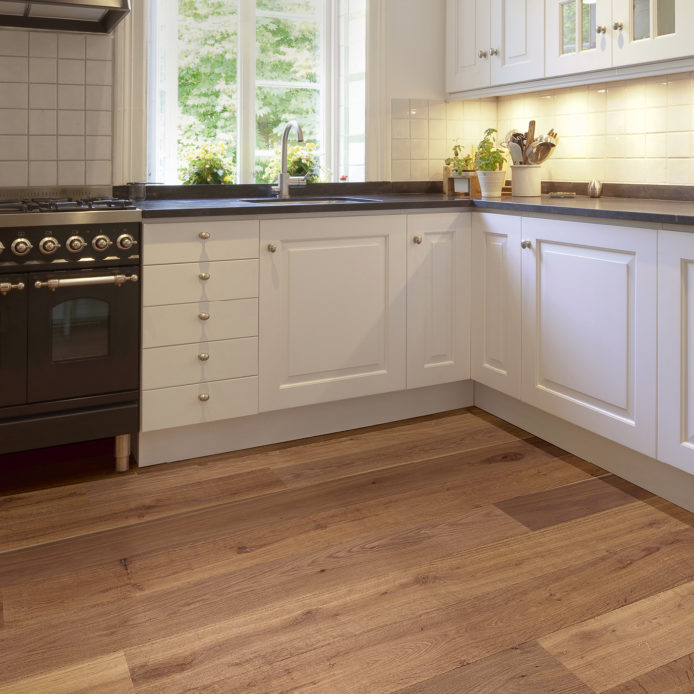
Identify the location of wooden floor. (536, 584).